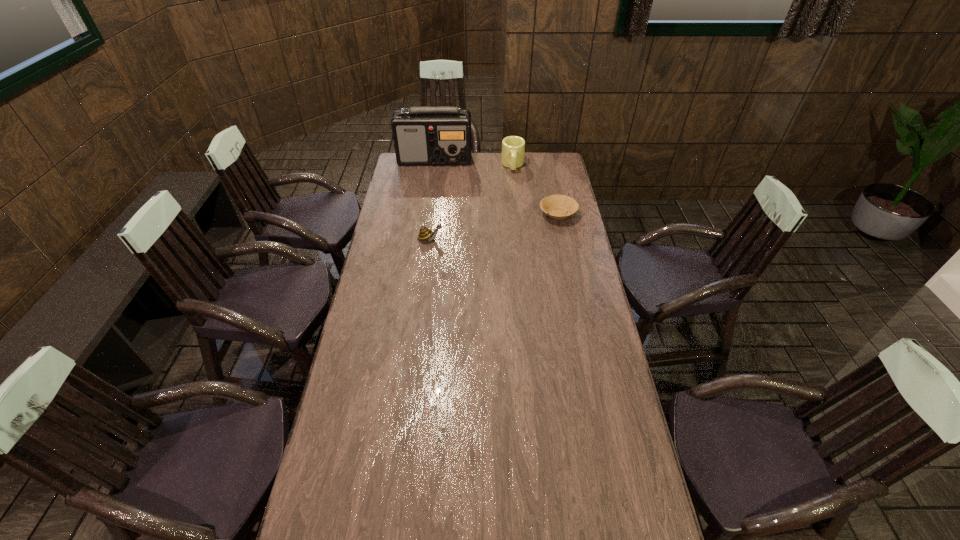
This screenshot has height=540, width=960. What are the coordinates of `vacant space in between the snail and the radio receiver` in the screenshot? It's located at (433, 199).

The height and width of the screenshot is (540, 960). In order to click on empty location between the second object from right to left and the rightmost object in this screenshot , I will do `click(536, 190)`.

Where is `free space between the mug and the radio receiver`? This screenshot has width=960, height=540. free space between the mug and the radio receiver is located at coordinates (473, 163).

At what (x,y) coordinates should I click in order to perform the action: click on empty space between the nearest object and the third object from left to right. Please return your answer as a coordinate pair (x, y). Looking at the image, I should click on (471, 202).

Locate which object is the third closest to the shortest object. Please provide its 2D coordinates. Your answer should be formatted as a tuple, i.e. [(x, y)], where the tuple contains the x and y coordinates of a point satisfying the conditions above.

[(427, 135)]

Locate an element on the screen. object that is the closest to the mug is located at coordinates (427, 135).

Find the location of a particular element. Image resolution: width=960 pixels, height=540 pixels. free spot that satisfies the following two spatial constraints: 1. on the front side of the tallest object; 2. on the face of the nearest object is located at coordinates coord(423,239).

Locate an element on the screen. The image size is (960, 540). vacant space that satisfies the following two spatial constraints: 1. on the front side of the mug; 2. on the left side of the radio receiver is located at coordinates (434, 165).